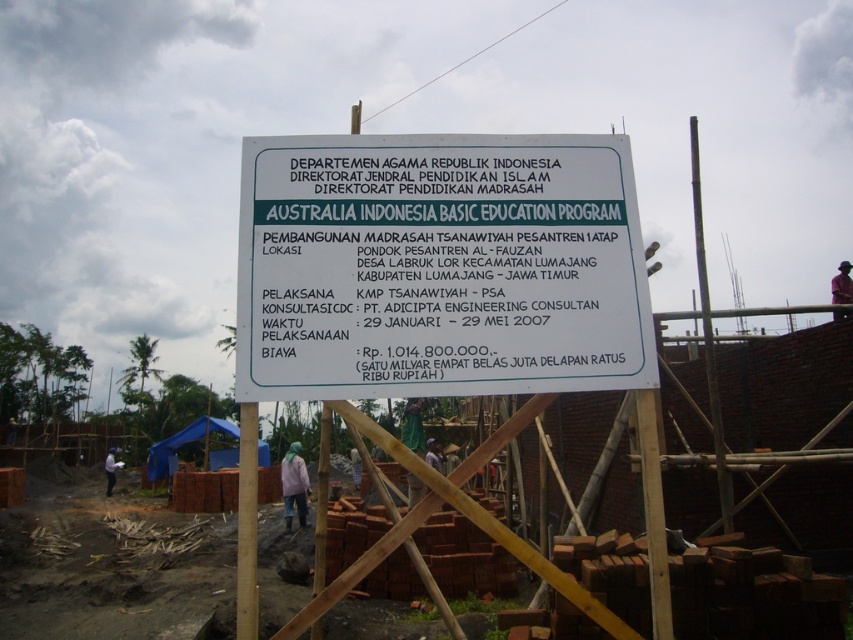
You are a construction worker who needs to update the project details on the signboard. Which sign should you modify first, the white plastic sign at center or the white wooden sign at center?

The white plastic sign at center is positioned over the white wooden sign at center, so you should modify the white plastic sign at center first to ensure the updated information is visible.

You are a construction worker who needs to place a new safety barrier between the white plastic sign at center and the pink fabric at center. The barrier requires a minimum of 12 meters of space to be installed properly. Based on the scene, can you install the barrier between these two objects?

The distance between the white plastic sign at center and the pink fabric at center is 10.66 meters, which is less than the required 12 meters. Therefore, the barrier cannot be installed between them.

You are a construction worker who needs to install a new sign. The new sign is 1.2 meters wide. You see the white plastic sign at center and the white wooden sign at center. Which existing sign can the new sign fit next to without exceeding its width?

The white plastic sign at center has a width less than the white wooden sign at center. Since the new sign is 1.2 meters wide, it can fit next to the white wooden sign at center as it is wider than the plastic one.